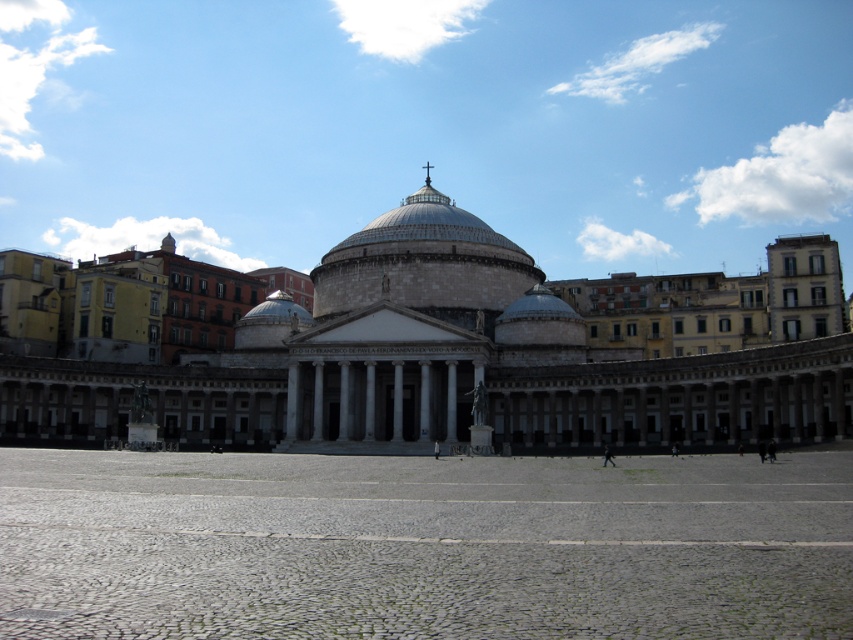
Can you confirm if white marble building at center is positioned below white stone dome at center?

Yes, white marble building at center is below white stone dome at center.

Where is `white marble building at center`? The width and height of the screenshot is (853, 640). white marble building at center is located at coordinates (466, 356).

The image size is (853, 640). What do you see at coordinates (466, 356) in the screenshot?
I see `white marble building at center` at bounding box center [466, 356].

Image resolution: width=853 pixels, height=640 pixels. I want to click on white marble building at center, so 466,356.